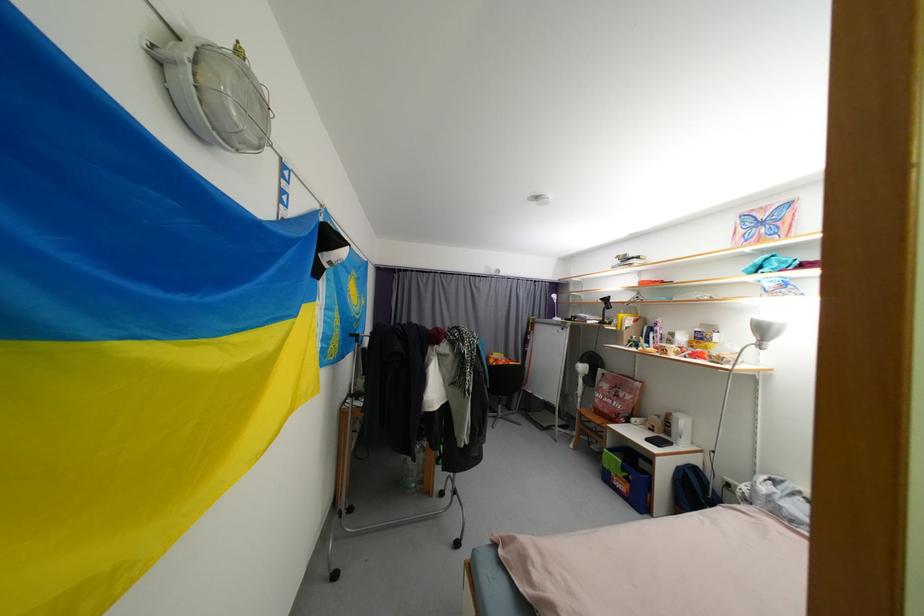
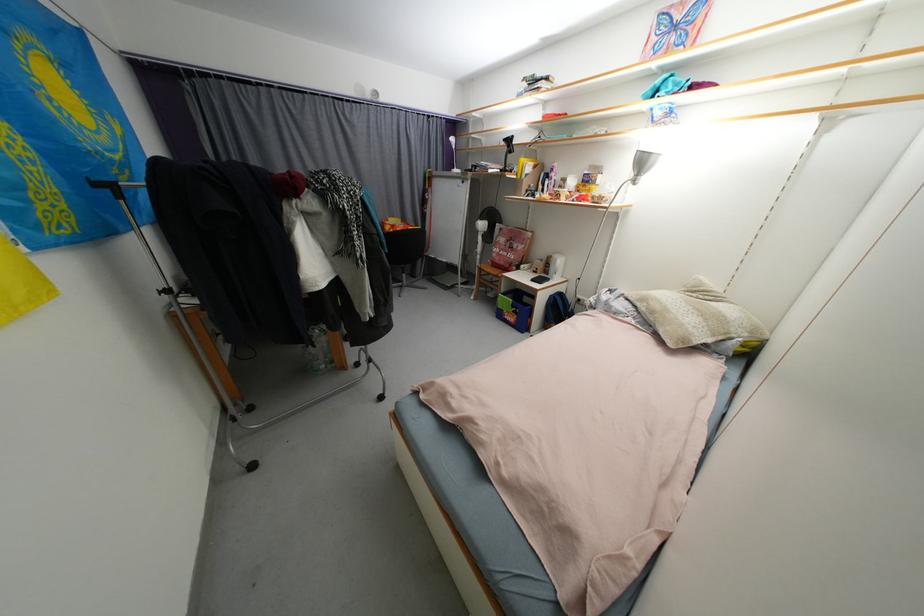
Locate, in the second image, the point that corresponds to (626,397) in the first image.

(520, 248)